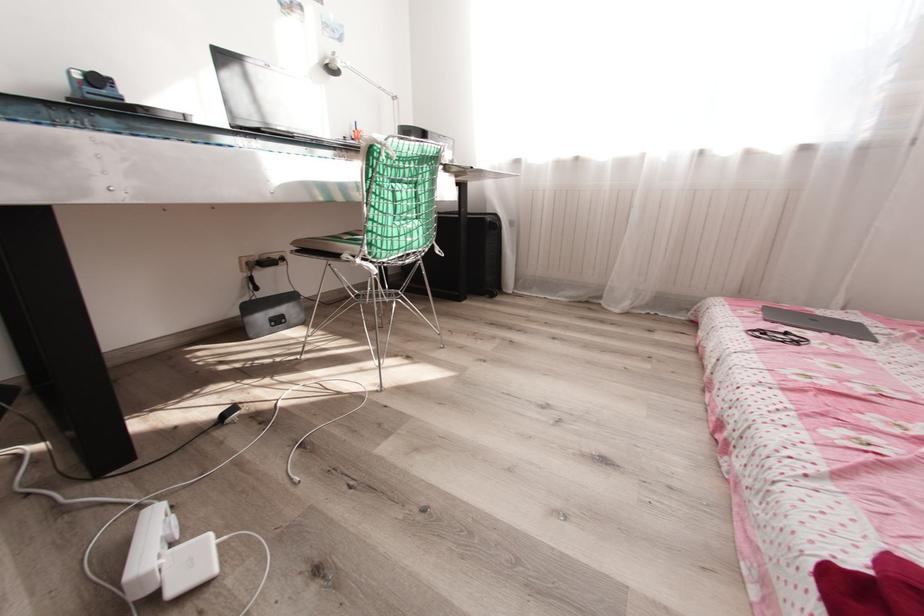
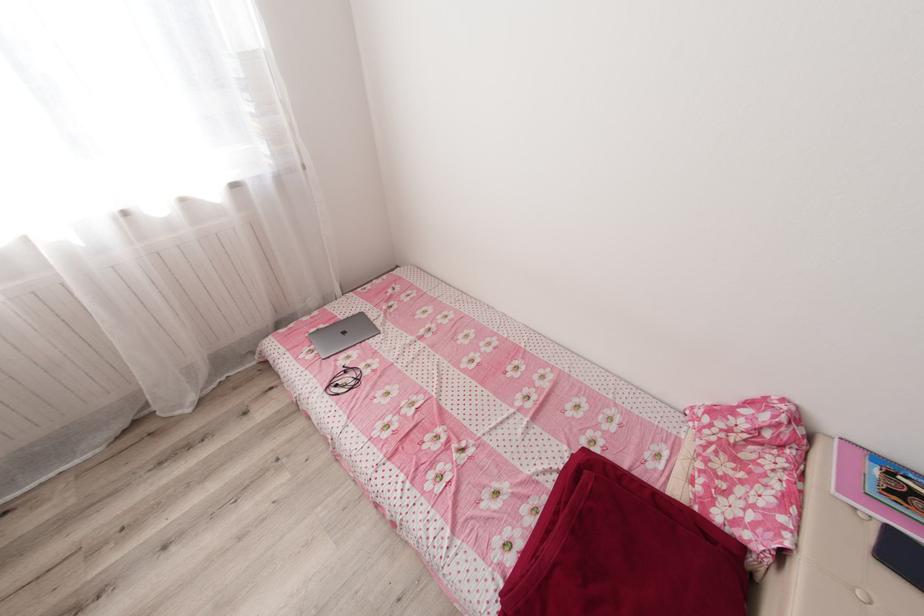
Locate, in the second image, the point that corresponds to point 861,325 in the first image.

(367, 315)